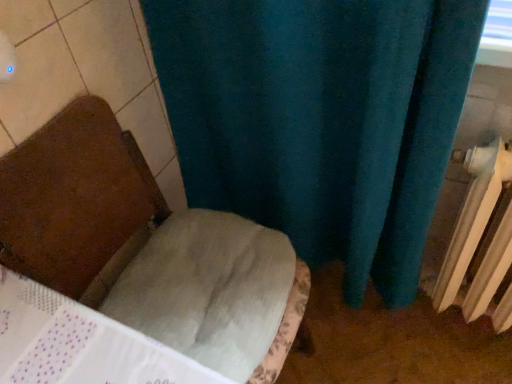
The image size is (512, 384). Identify the location of free area below white plastic radiator at right (from a real-world perspective). (444, 327).